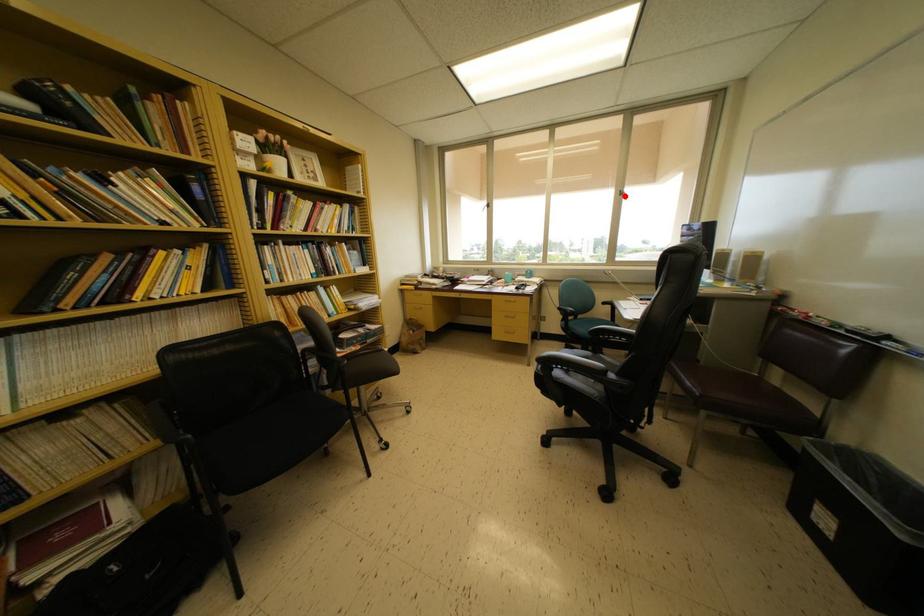
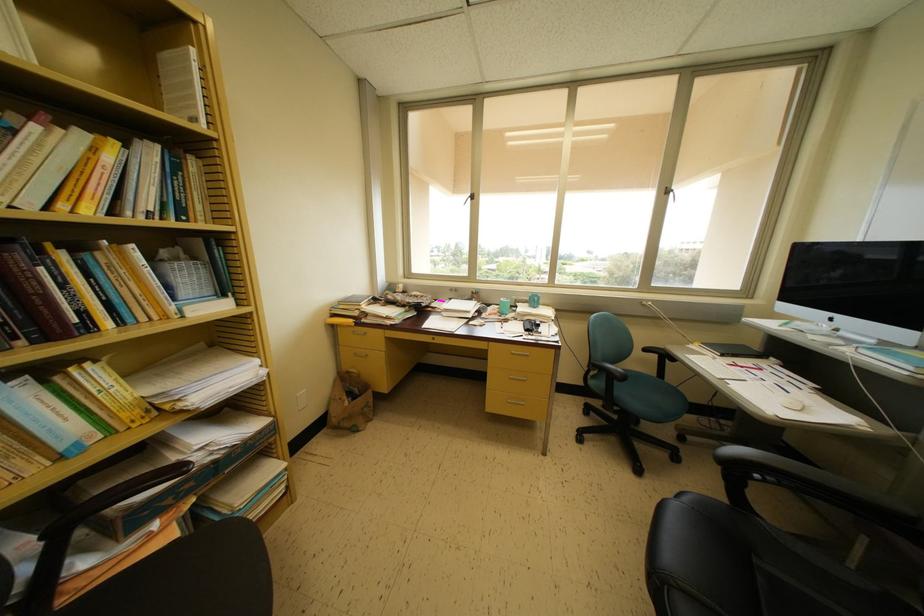
Where in the second image is the point corresponding to the highlighted location from the first image?

(671, 193)